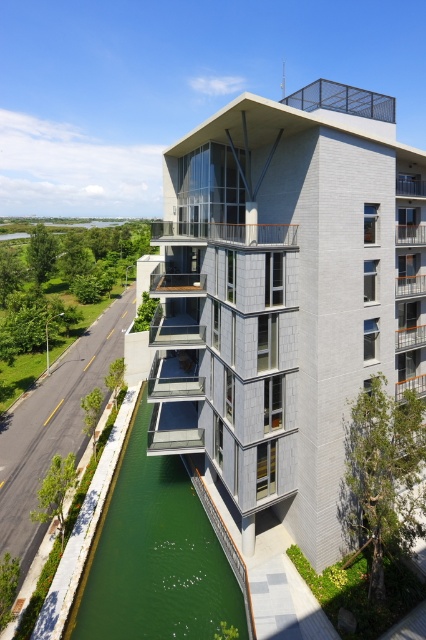
You are a window cleaner standing on the wooden at center. You need to clean the glassy concrete balcony at upper right. Can you reach it from your current position?

The wooden at center is below the glassy concrete balcony at upper right, so you can reach it by moving upwards from the wooden at center to the glassy concrete balcony at upper right.